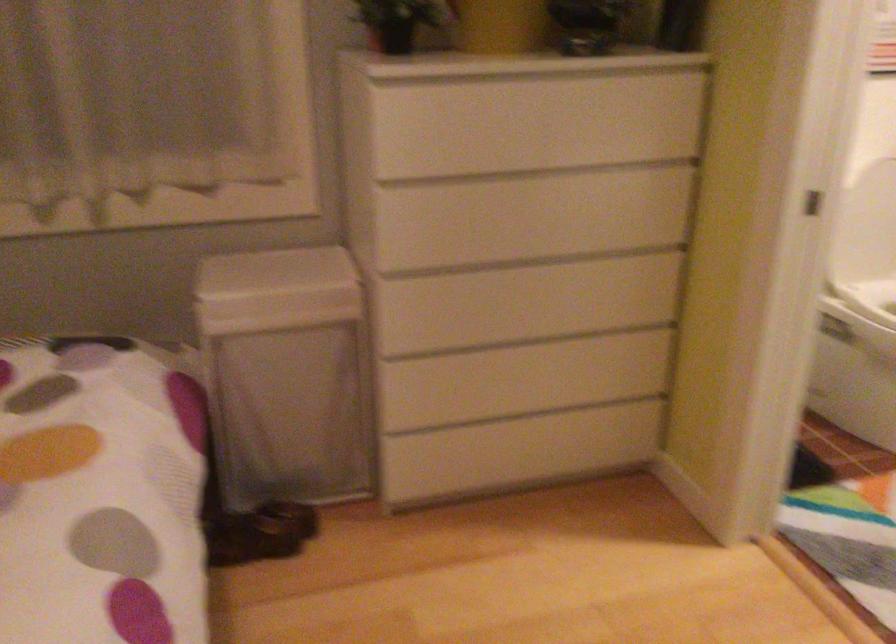
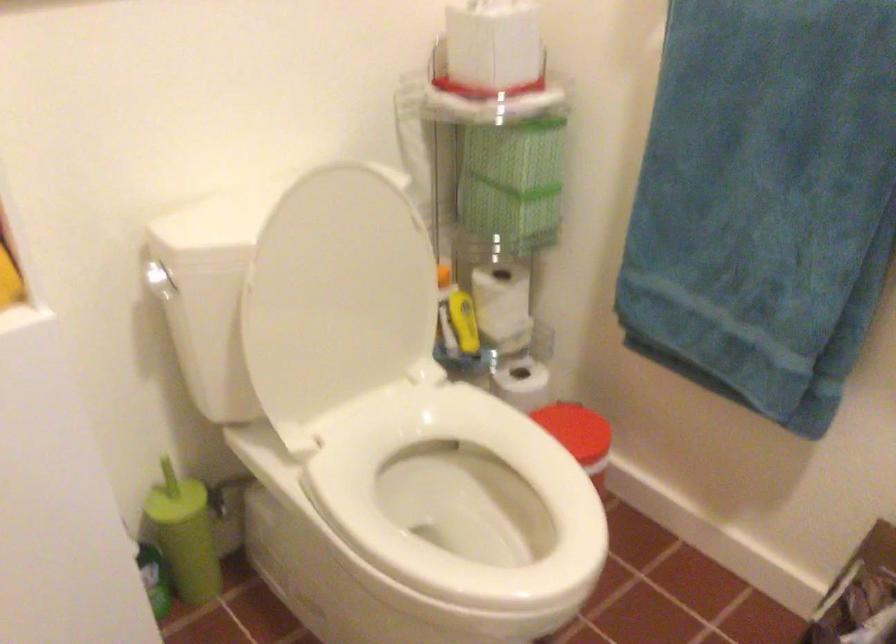
In a continuous first-person perspective shot, in which direction is the camera moving?

The cameraman walked toward right, forward.